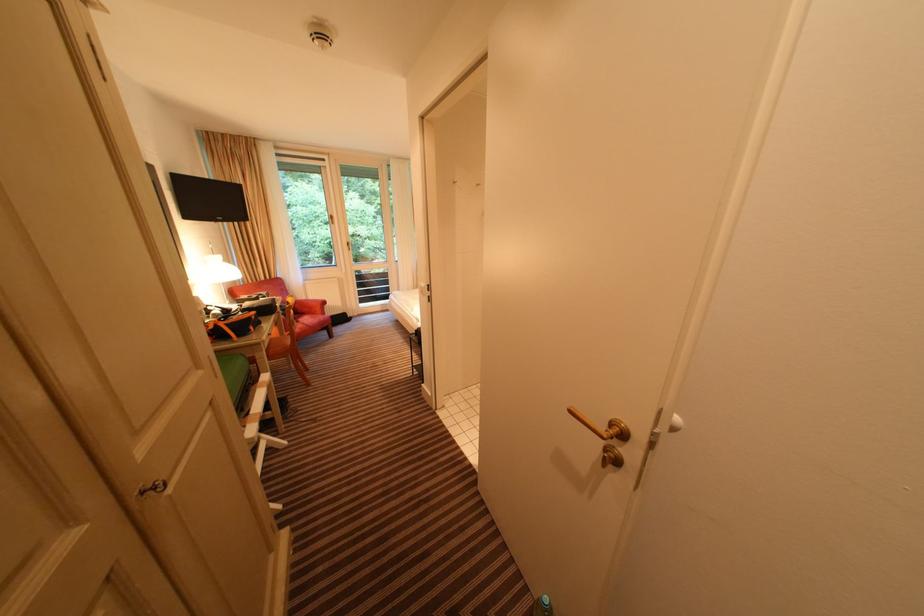
This screenshot has width=924, height=616. Describe the element at coordinates (310, 312) in the screenshot. I see `a red chair sitting surface` at that location.